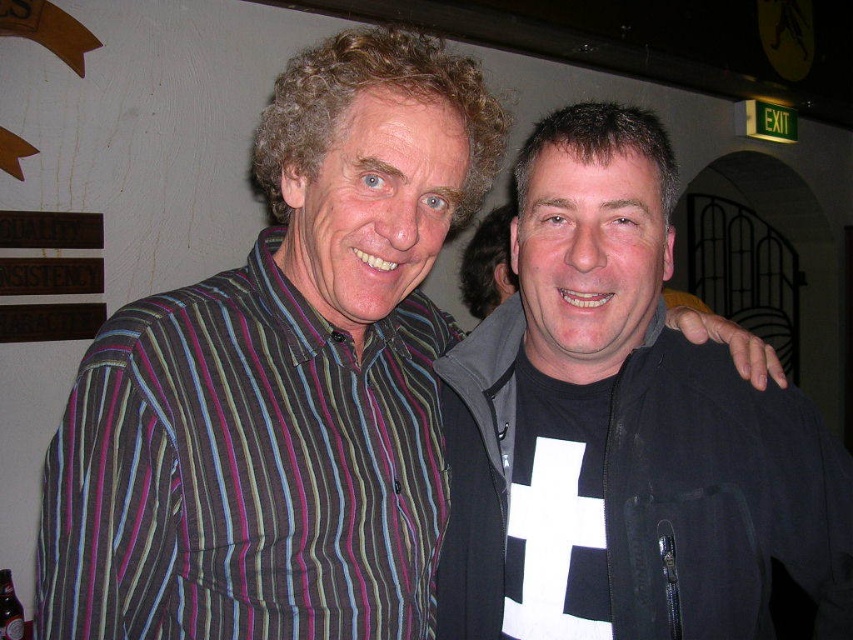
Question: Based on their relative distances, which object is farther from the brown glass bottle at lower left?

Choices:
 (A) black matte jacket at right
 (B) striped cotton shirt at left

Answer: (A)

Question: Does black matte jacket at right appear over brown glass bottle at lower left?

Choices:
 (A) no
 (B) yes

Answer: (B)

Question: Is the position of black matte jacket at right less distant than that of striped cotton shirt at left?

Choices:
 (A) no
 (B) yes

Answer: (A)

Question: Considering the real-world distances, which object is closest to the striped cotton shirt at left?

Choices:
 (A) brown glass bottle at lower left
 (B) black matte jacket at right

Answer: (B)

Question: Which point appears closest to the camera in this image?

Choices:
 (A) (717, 556)
 (B) (0, 609)
 (C) (79, 364)

Answer: (C)

Question: Where is black matte jacket at right located in relation to striped cotton shirt at left in the image?

Choices:
 (A) below
 (B) above

Answer: (B)